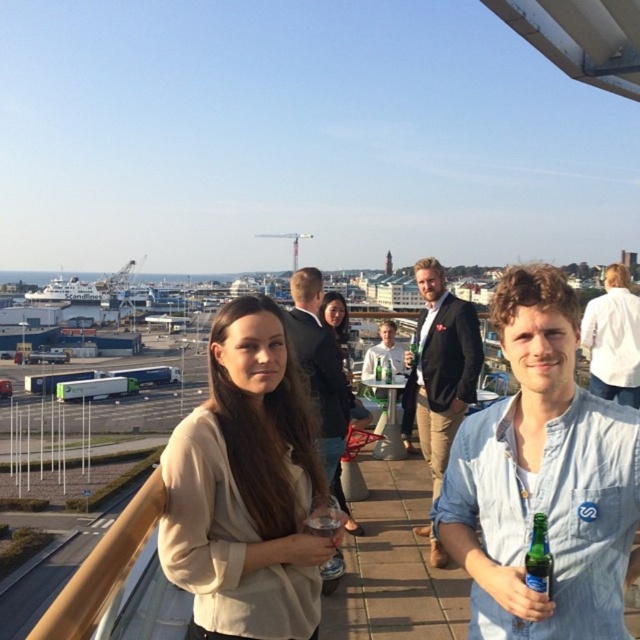
Question: Which point is closer to the camera taking this photo?

Choices:
 (A) (525, 586)
 (B) (522, 538)
 (C) (628, 332)
 (D) (456, 497)

Answer: (A)

Question: Does beige fabric shirt at center have a lesser width compared to white cotton shirt at upper right?

Choices:
 (A) yes
 (B) no

Answer: (A)

Question: Based on their relative distances, which object is nearer to the light brown leather jacket at center?

Choices:
 (A) light blue denim shirt at center
 (B) beige fabric shirt at center
 (C) dark brown leather jacket at center
 (D) green glass bottle at lower right

Answer: (B)

Question: Which point is farther to the camera?

Choices:
 (A) (552, 323)
 (B) (310, 339)
 (C) (516, 358)

Answer: (B)

Question: Does matte beige blouse at center appear under white cotton shirt at upper right?

Choices:
 (A) yes
 (B) no

Answer: (A)

Question: Does beige fabric shirt at center have a greater width compared to light brown leather jacket at center?

Choices:
 (A) yes
 (B) no

Answer: (A)